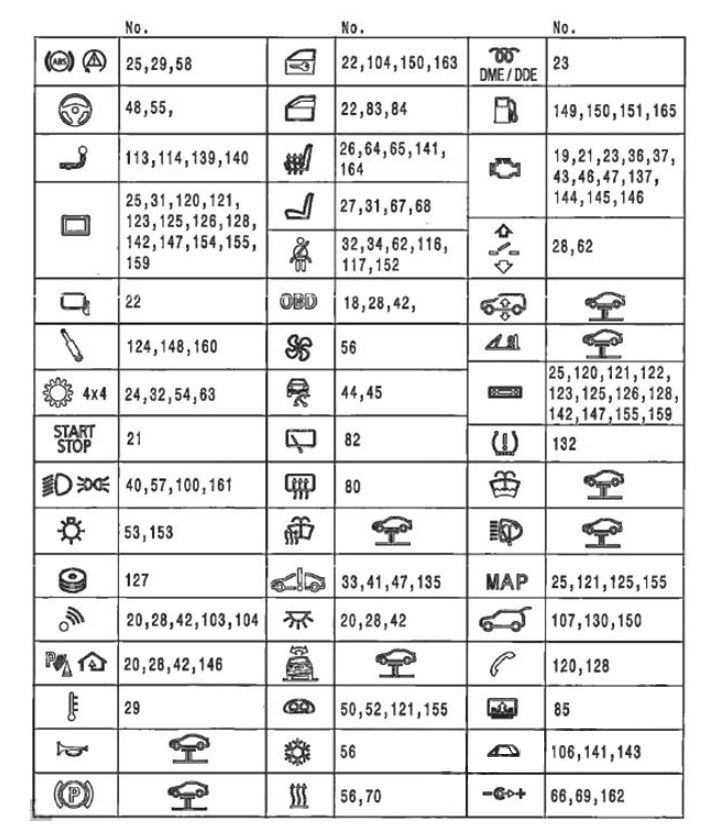
Where is `phone`? This screenshot has height=836, width=705. phone is located at coordinates pyautogui.click(x=519, y=668).